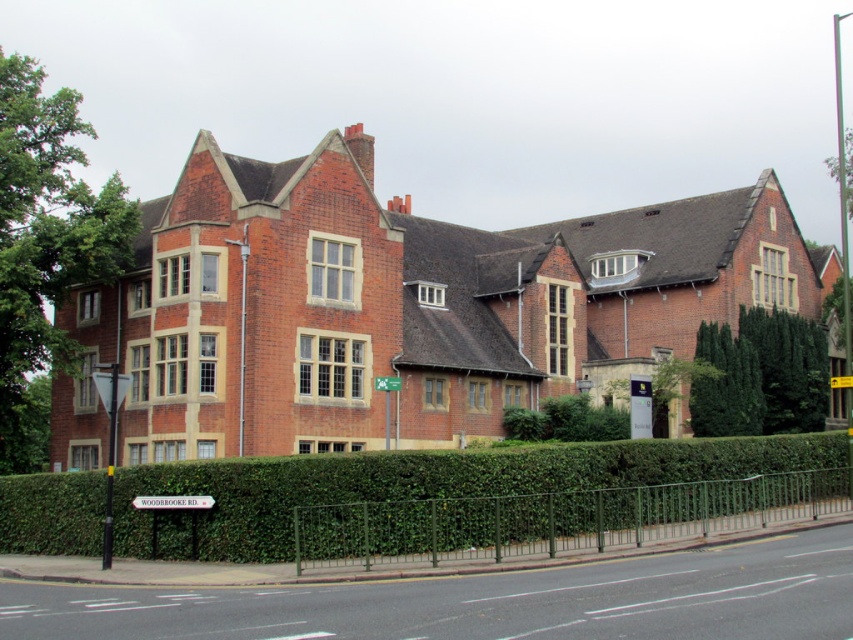
The height and width of the screenshot is (640, 853). Describe the element at coordinates (759, 376) in the screenshot. I see `dark green leafy hedge at right` at that location.

Where is `dark green leafy hedge at right`? dark green leafy hedge at right is located at coordinates (759, 376).

Who is positioned more to the right, green leafy hedge at lower center or green plastic sign at center?

green leafy hedge at lower center is more to the right.

This screenshot has height=640, width=853. I want to click on green leafy hedge at lower center, so pos(444,477).

Identify the location of green leafy hedge at lower center. The image size is (853, 640). (444, 477).

Is green leafy hedge at lower center thinner than dark green leafy hedge at right?

No.

Find the location of a particular element. green leafy hedge at lower center is located at coordinates (444, 477).

Locate an element on the screen. The width and height of the screenshot is (853, 640). green leafy hedge at lower center is located at coordinates (444, 477).